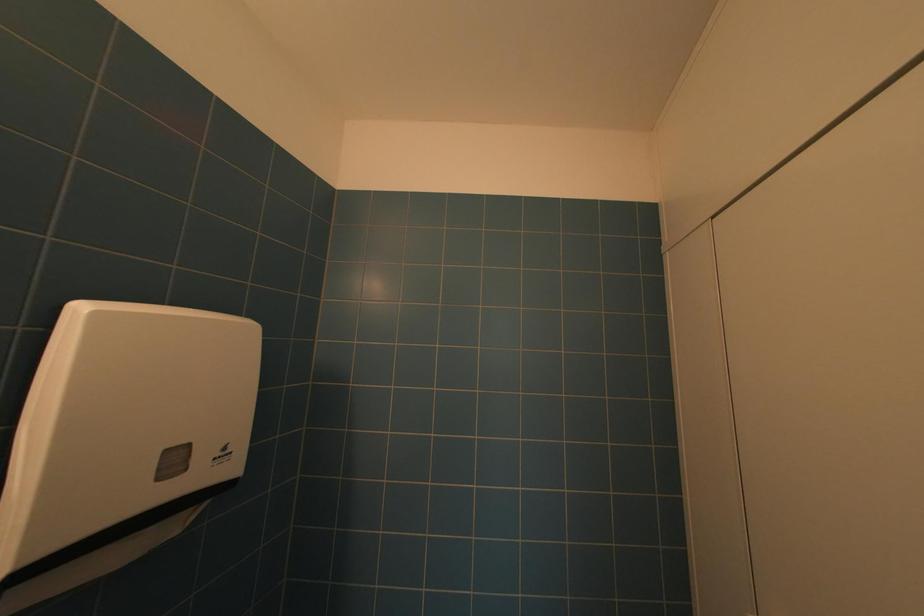
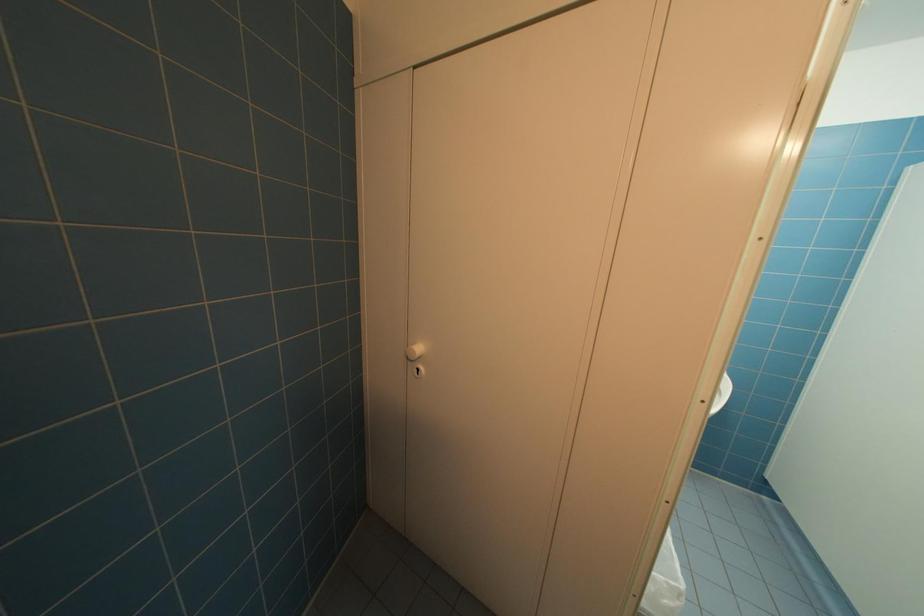
First-person continuous shooting, in which direction is the camera rotating?

The camera rotated toward right-down.